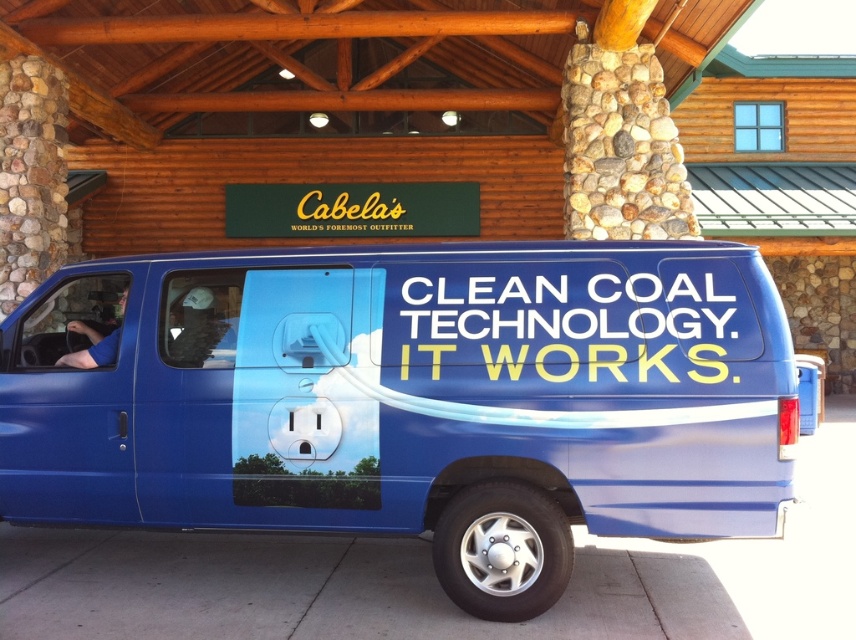
You are a photographer trying to capture both the blue metallic van at center and the blue fabric shirt at left in a single frame. Given their sizes, which object should you focus on to ensure both fit in the photo?

The blue metallic van at center is bigger than the blue fabric shirt at left, so you should focus on capturing the larger van first to ensure both fit in the frame.

From the picture: What is the object located at the coordinates point (412, 400) in the image?

The point (412, 400) indicates the blue metallic van at center.

From the picture: You are a pedestrian standing on the sidewalk looking at the blue metallic van at center and the blue fabric shirt at left. Which object is positioned lower from your viewpoint?

The blue metallic van at center is located below the blue fabric shirt at left, so the van is positioned lower from your viewpoint.